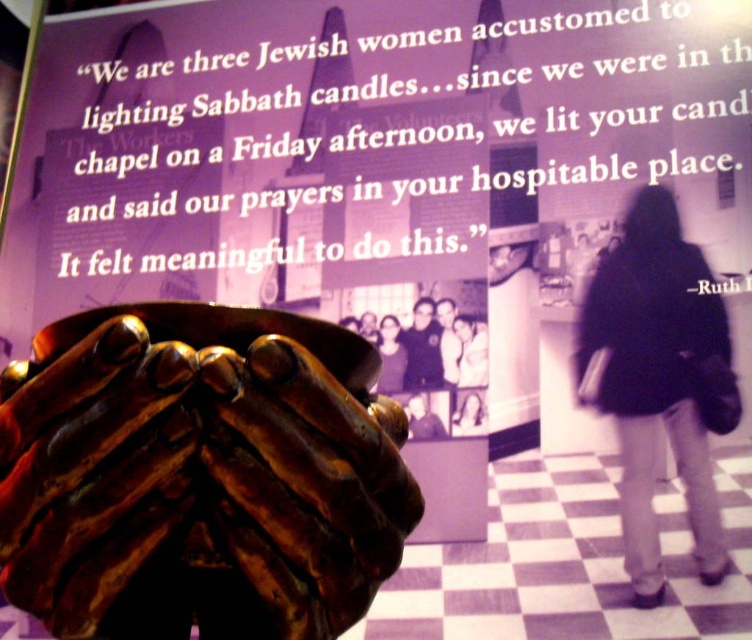
Which is in front, point (17, 522) or point (584, 323)?

Point (17, 522)

The width and height of the screenshot is (752, 640). What do you see at coordinates (199, 476) in the screenshot? I see `shiny bronze hands at center` at bounding box center [199, 476].

Which is behind, point (150, 628) or point (693, 435)?

The point (693, 435) is behind.

This screenshot has width=752, height=640. Find the location of `shiny bronze hands at center`. shiny bronze hands at center is located at coordinates (199, 476).